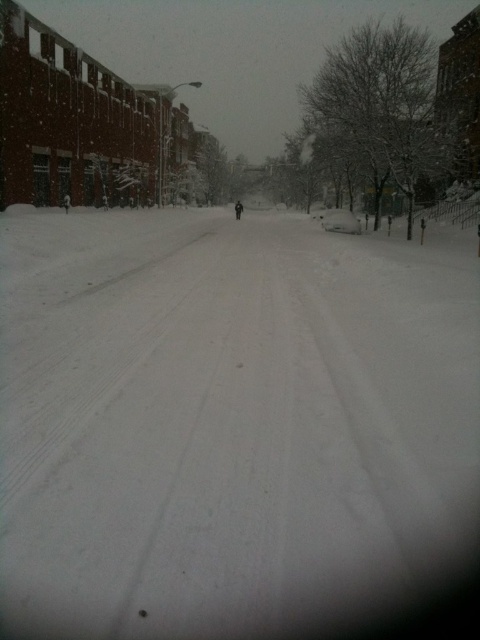
Question: Can you confirm if white powdery snow at center is bigger than black matte person at center?

Choices:
 (A) no
 (B) yes

Answer: (B)

Question: Does white powdery snow at center appear under black matte person at center?

Choices:
 (A) no
 (B) yes

Answer: (B)

Question: Observing the image, what is the correct spatial positioning of white powdery snow at center in reference to black matte person at center?

Choices:
 (A) left
 (B) right

Answer: (A)